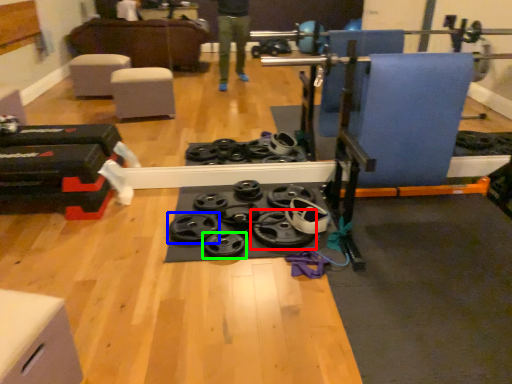
Question: Which object is the closest to the wheel (highlighted by a red box)? Choose among these: wheel (highlighted by a blue box) or wheel (highlighted by a green box).

Choices:
 (A) wheel
 (B) wheel

Answer: (B)